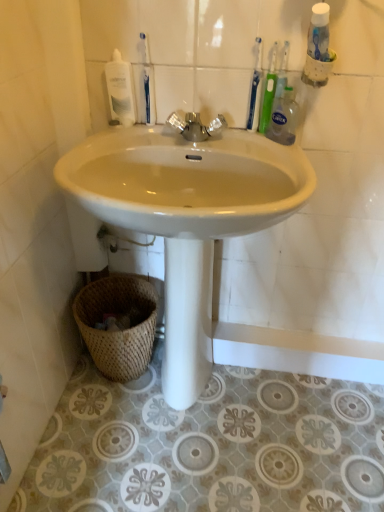
Question: Is clear plastic bottle at upper right inside or outside of silver metallic faucet at center?

Choices:
 (A) inside
 (B) outside

Answer: (B)

Question: Is point (289, 141) positioned closer to the camera than point (200, 123)?

Choices:
 (A) farther
 (B) closer

Answer: (B)

Question: Which object is the farthest from the silver metallic faucet at center?

Choices:
 (A) green plastic toothbrush at upper right, which is the 3th toothbrush from left to right
 (B) blue plastic toothbrush at upper center, which appears as the 1th toothbrush when viewed from the left
 (C) woven natural basket at lower left
 (D) blue plastic toothbrush at upper right, acting as the second toothbrush starting from the right
 (E) clear plastic bottle at upper right

Answer: (C)

Question: Estimate the real-world distances between objects in this image. Which object is closer to the clear plastic bottle at upper right?

Choices:
 (A) woven natural basket at lower left
 (B) white glossy mouthwash at upper left
 (C) green plastic toothbrush at upper right, the 1th toothbrush when ordered from right to left
 (D) silver metallic faucet at center
 (E) blue plastic toothbrush at upper center, which appears as the 1th toothbrush when viewed from the left

Answer: (C)